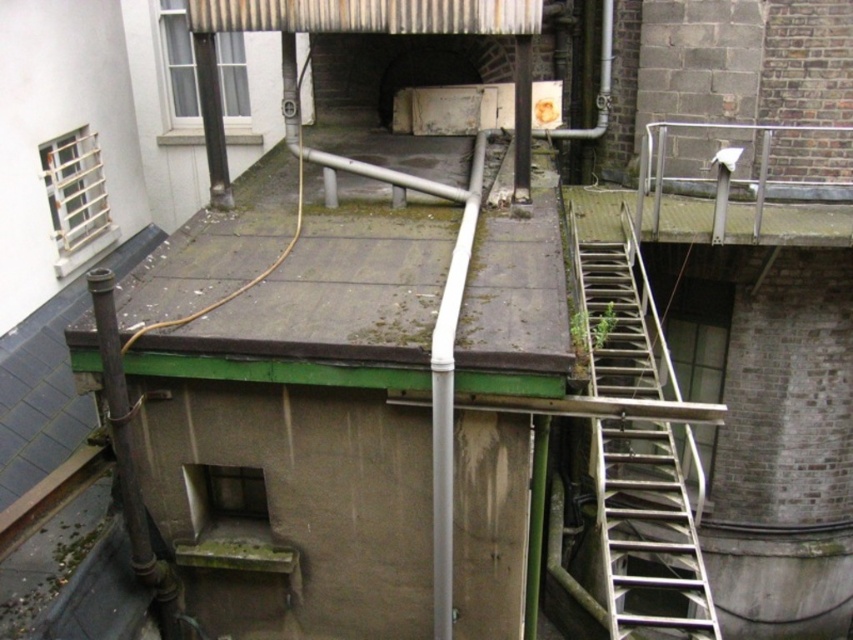
You are a maintenance worker needing to reach the rusty corrugated metal roof at upper center. You see a metallic silver ladder at right nearby. Considering their sizes, which object should you use to access the roof area?

The metallic silver ladder at right is larger in size than the rusty corrugated metal roof at upper center, so you should use the metallic silver ladder at right to access the roof area since its larger size makes it more stable and appropriate for reaching the roof.

You are standing on the rooftop and need to access the metallic silver ladder at right. Given that the average human stride is 0.76 meters, how many steps would you need to take to reach the ladder?

The metallic silver ladder at right is 7.09 meters away. Dividing the distance by the average stride length of 0.76 meters gives approximately 9.33 steps. Since you can only take whole steps, you would need to take 10 steps to reach the ladder.